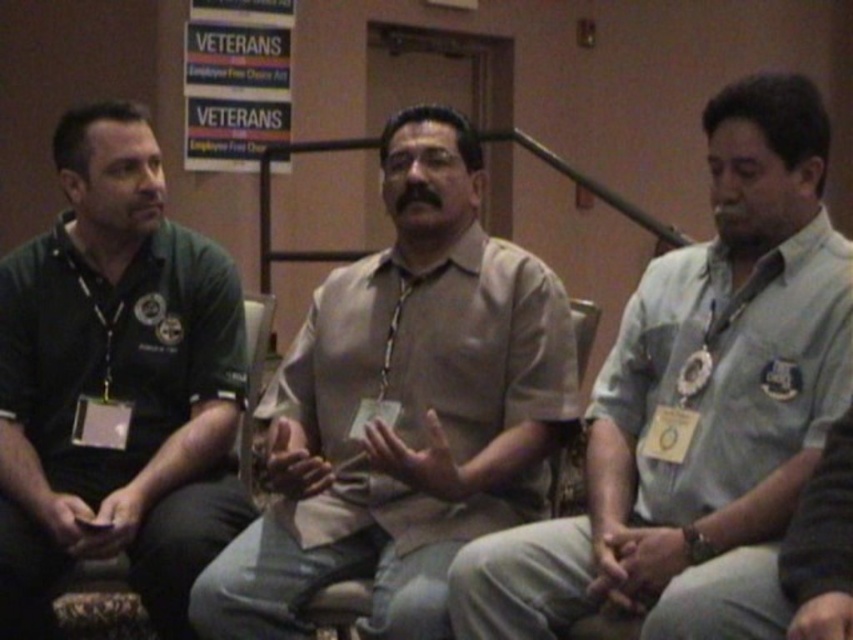
Question: Is light gray shirt at center closer to the viewer compared to dark green polo shirt at left?

Choices:
 (A) no
 (B) yes

Answer: (B)

Question: Is beige fabric shirt at center bigger than dark green polo shirt at left?

Choices:
 (A) no
 (B) yes

Answer: (B)

Question: Estimate the real-world distances between objects in this image. Which object is closer to the beige fabric shirt at center?

Choices:
 (A) light gray shirt at center
 (B) dark green polo shirt at left
 (C) wooden chair at center

Answer: (A)

Question: Which object appears farthest from the camera in this image?

Choices:
 (A) dark green polo shirt at left
 (B) wooden chair at center

Answer: (B)

Question: Does light gray shirt at center have a greater width compared to dark green polo shirt at left?

Choices:
 (A) no
 (B) yes

Answer: (B)

Question: Based on their relative distances, which object is nearer to the light gray shirt at center?

Choices:
 (A) beige fabric shirt at center
 (B) wooden chair at center
 (C) dark green polo shirt at left

Answer: (A)